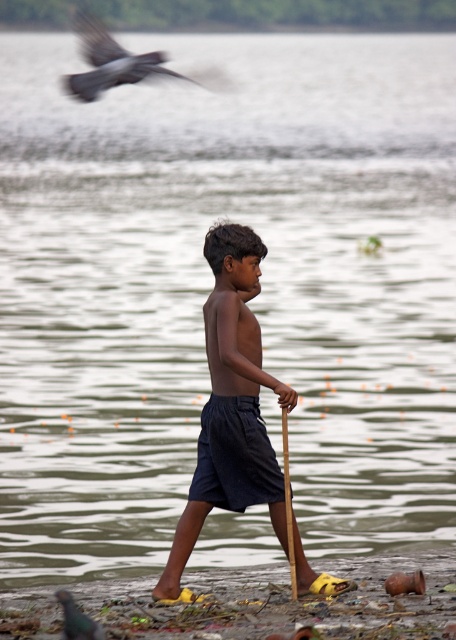
Does dark blue shorts at center have a greater width compared to green glossy bird at lower left?

Yes, dark blue shorts at center is wider than green glossy bird at lower left.

Between dark blue shorts at center and green glossy bird at lower left, which one has less height?

Standing shorter between the two is green glossy bird at lower left.

I want to click on dark blue shorts at center, so click(x=231, y=403).

Identify the location of dark blue shorts at center. The width and height of the screenshot is (456, 640). (231, 403).

Between yellow rubber sandals at lower center and green glossy bird at lower left, which one appears on the right side from the viewer's perspective?

yellow rubber sandals at lower center is more to the right.

Who is taller, yellow rubber sandals at lower center or green glossy bird at lower left?

green glossy bird at lower left is taller.

Who is more forward, (5,627) or (93,620)?

Point (93,620) is in front.

The image size is (456, 640). In order to click on yellow rubber sandals at lower center in this screenshot , I will do `click(281, 604)`.

Who is higher up, yellow rubber sandals at lower center or dark blue shorts at center?

Positioned higher is dark blue shorts at center.

Does point (368, 598) come farther from viewer compared to point (269, 460)?

No.

Locate an element on the screen. Image resolution: width=456 pixels, height=640 pixels. yellow rubber sandals at lower center is located at coordinates (281, 604).

The width and height of the screenshot is (456, 640). Find the location of `yellow rubber sandals at lower center`. yellow rubber sandals at lower center is located at coordinates (281, 604).